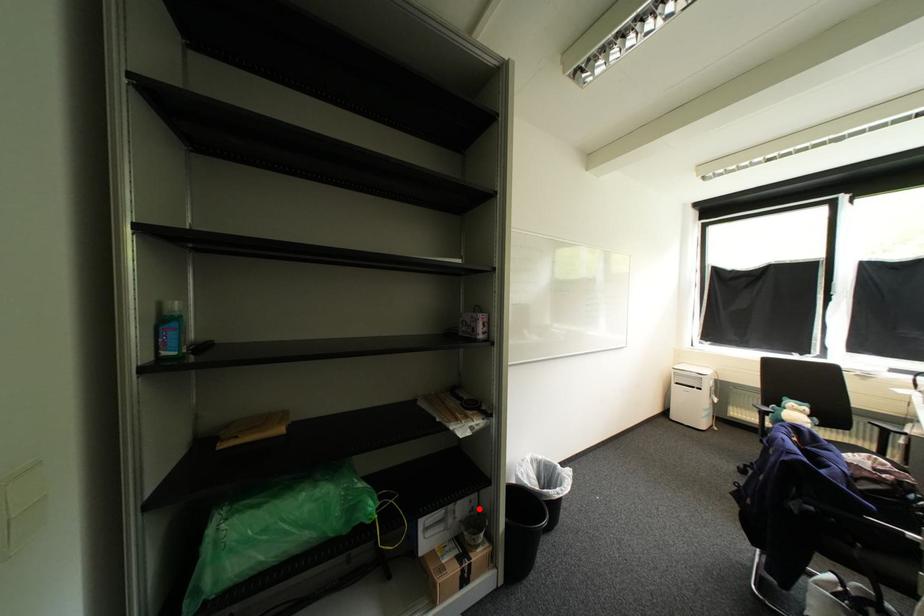
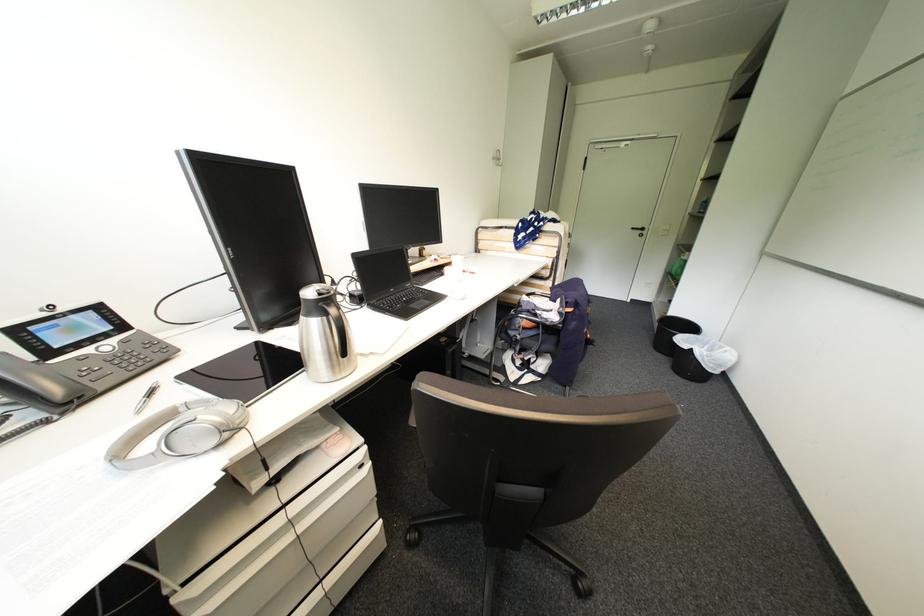
Question: I am providing you with two images of the same scene from different viewpoints. A red point is marked on the first image. Can you still see the location of the red point in image 2?

Choices:
 (A) Yes
 (B) No

Answer: (B)